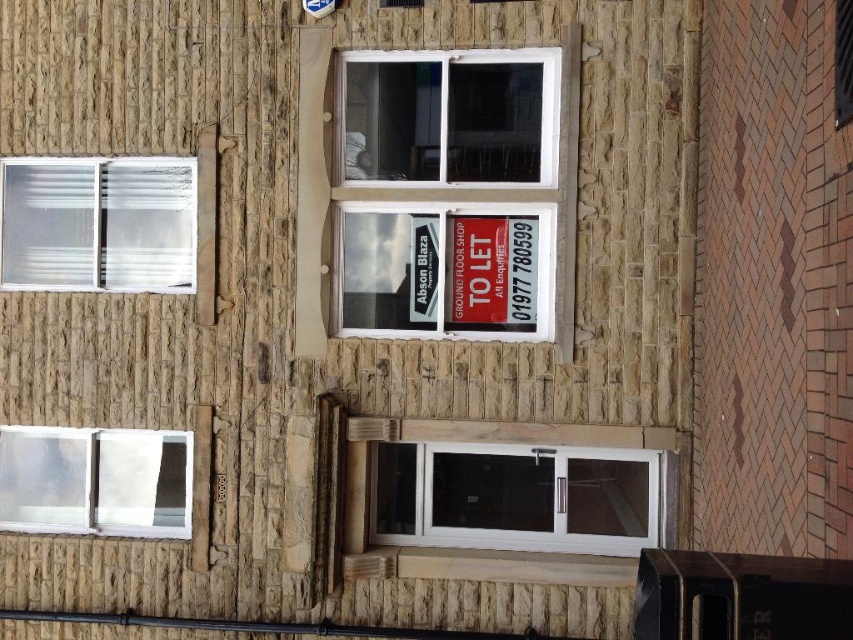
You are a delivery person with a package that requires a clearance of 7 feet to pass through. You need to move from the transparent plastic window at upper left to the white glass door at lower center. Can you pass through the space between them without tilting the package?

The distance between the white glass door at lower center and the transparent plastic window at upper left is 7.46 feet, which is greater than the required 7 feet clearance. Therefore, you can pass through the space between them without tilting the package.